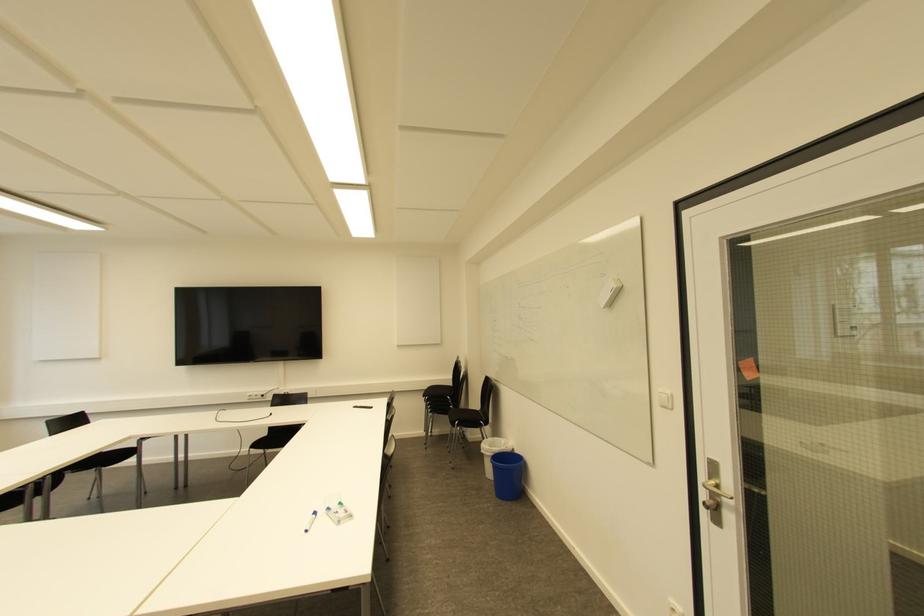
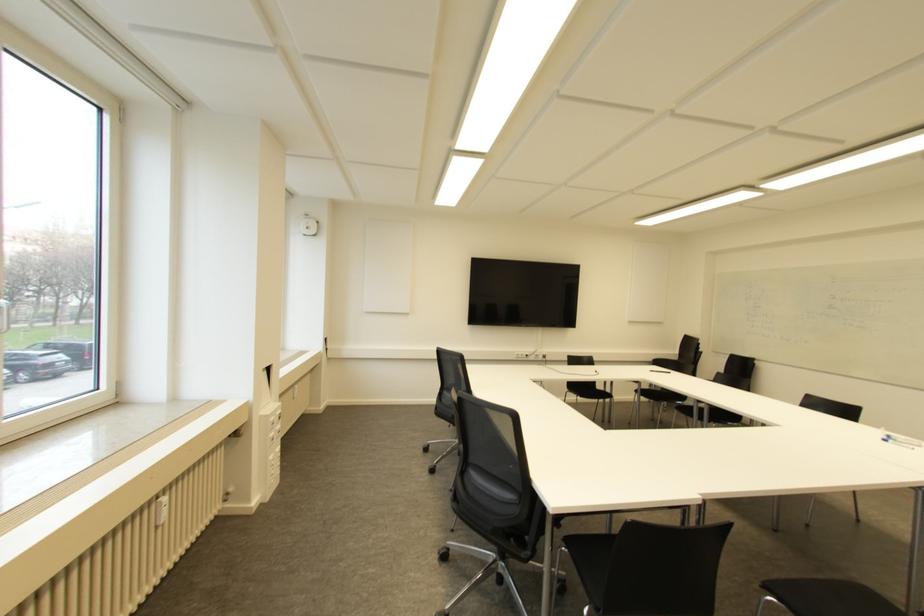
Question: In a continuous first-person perspective shot, in which direction is the camera moving?

Choices:
 (A) Left
 (B) Right
 (C) Forward
 (D) Backward

Answer: (A)